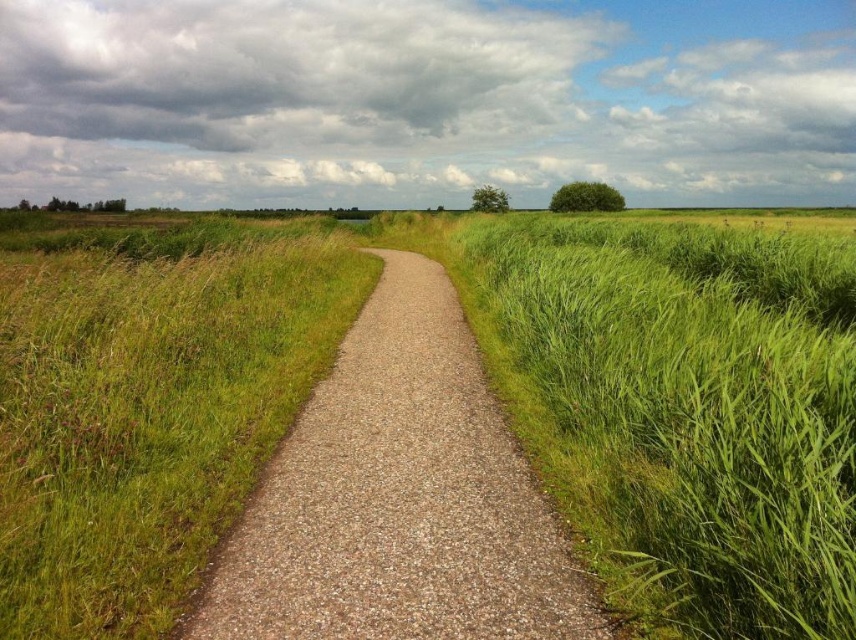
Between point (260, 426) and point (277, 624), which one is positioned in front?

Point (277, 624)

Between green grassy wheat field at center and brown gravel path at center, which one is positioned higher?

green grassy wheat field at center

I want to click on green grassy wheat field at center, so click(492, 385).

Identify the location of green grassy wheat field at center. (492, 385).